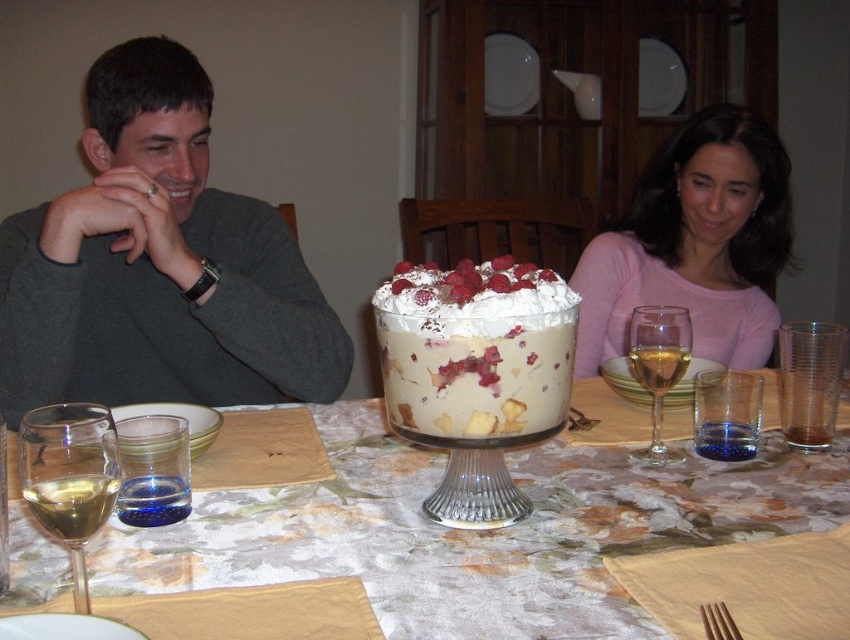
Question: Among these objects, which one is nearest to the camera?

Choices:
 (A) clear glass wine glass at lower left
 (B) gray matte sweater at upper left
 (C) whipped cream topped trifle at center
 (D) pink matte sweater at upper right

Answer: (A)

Question: Is matte gray sweater at upper left in front of whipped cream topped trifle at center?

Choices:
 (A) no
 (B) yes

Answer: (A)

Question: Is clear glass trifle at center bigger than whipped cream topped trifle at center?

Choices:
 (A) yes
 (B) no

Answer: (A)

Question: Among these points, which one is nearest to the camera?

Choices:
 (A) (712, 177)
 (B) (661, 412)

Answer: (B)

Question: Can you confirm if matte gray sweater at upper left is thinner than clear glass wine glass at lower left?

Choices:
 (A) yes
 (B) no

Answer: (B)

Question: Estimate the real-world distances between objects in this image. Which object is farther from the whipped cream topped trifle at center?

Choices:
 (A) clear glass trifle at center
 (B) clear glass wine glass at center right
 (C) pink matte sweater at upper right

Answer: (C)